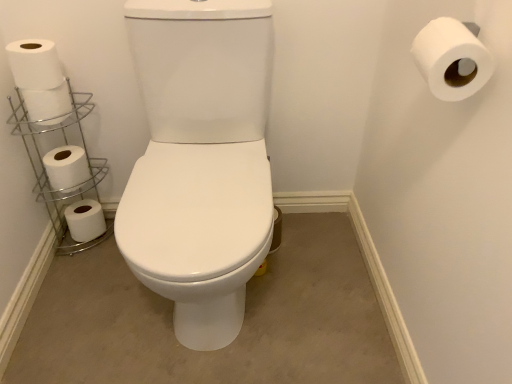
You are a GUI agent. You are given a task and a screenshot of the screen. Output one action in this format:
    pyautogui.click(x=<x>, y=<y>)
    Task: Click on the free space in front of white matte toilet paper at lower left, marked as the fifth toilet paper in a right-to-left arrangement
    
    Given the screenshot: What is the action you would take?
    pyautogui.click(x=80, y=263)